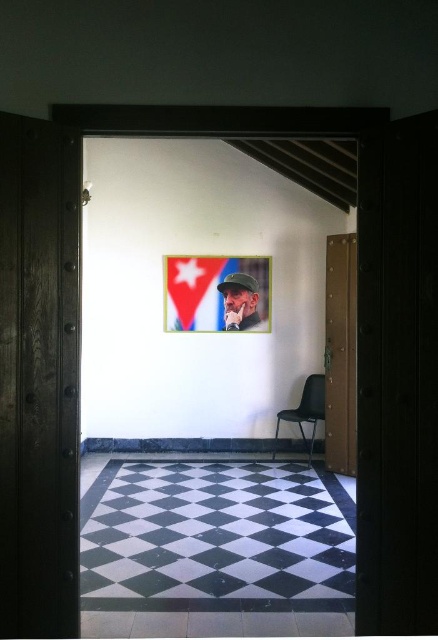
Does matte black portrait at center have a larger size compared to black plastic chair at center?

No.

Who is higher up, matte black portrait at center or black plastic chair at center?

Positioned higher is matte black portrait at center.

Is point (250, 300) positioned behind point (275, 436)?

Yes, it is.

Locate an element on the screen. matte black portrait at center is located at coordinates (240, 300).

In the scene shown: Between matte cardboard poster at center and black plastic chair at center, which one is positioned higher?

matte cardboard poster at center is above.

Who is positioned more to the left, matte cardboard poster at center or black plastic chair at center?

Positioned to the left is matte cardboard poster at center.

This screenshot has height=640, width=438. What do you see at coordinates (216, 292) in the screenshot?
I see `matte cardboard poster at center` at bounding box center [216, 292].

Where is `matte cardboard poster at center`? The image size is (438, 640). matte cardboard poster at center is located at coordinates (216, 292).

In the scene shown: Is matte cardboard poster at center further to the viewer compared to matte black portrait at center?

No, it is not.

Which is more to the right, matte cardboard poster at center or matte black portrait at center?

matte black portrait at center is more to the right.

The width and height of the screenshot is (438, 640). In order to click on matte cardboard poster at center in this screenshot , I will do `click(216, 292)`.

Where is `matte cardboard poster at center`? The width and height of the screenshot is (438, 640). matte cardboard poster at center is located at coordinates (216, 292).